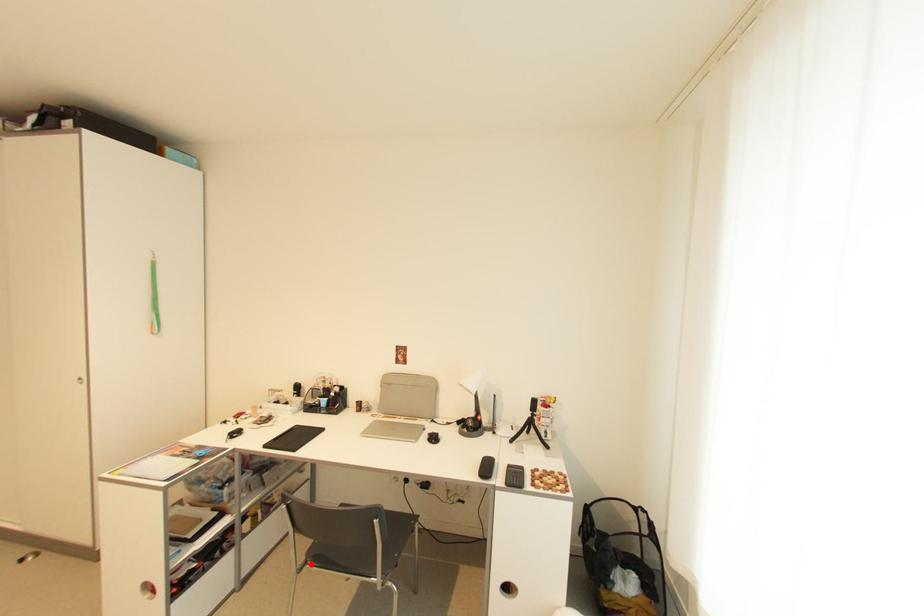
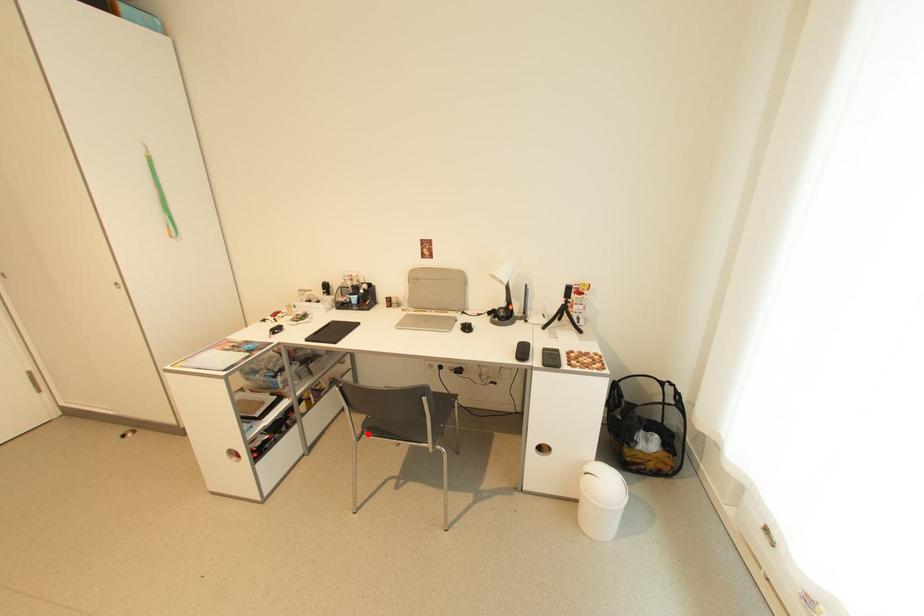
I am providing you with two images of the same scene from different viewpoints. A red point is marked on the first image and another point is marked on the second image. Do the highlighted points in image1 and image2 indicate the same real-world spot?

Yes